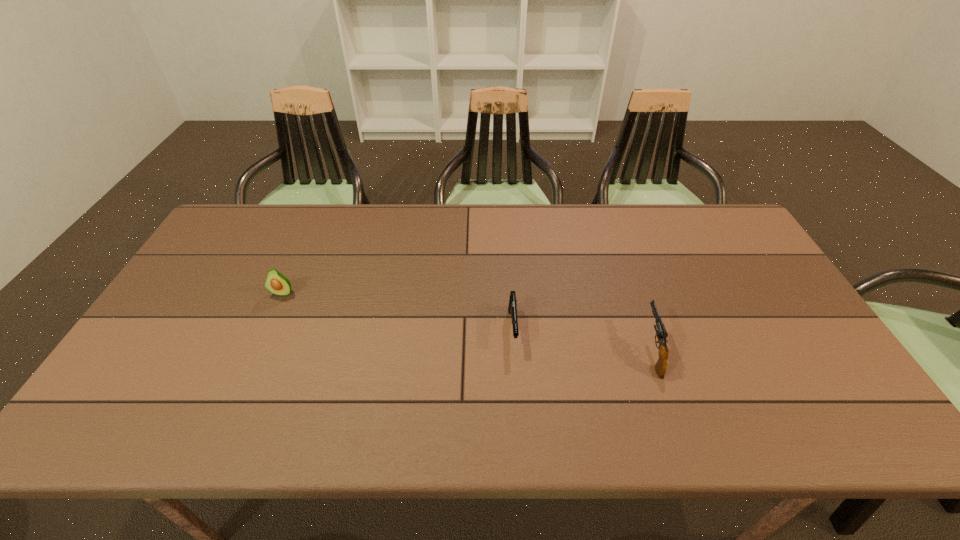
I want to click on the right gun, so click(660, 367).

I want to click on the taller gun, so click(660, 367).

Find the location of a particular element. The height and width of the screenshot is (540, 960). the leftmost object is located at coordinates (277, 283).

This screenshot has height=540, width=960. Identify the location of avocado. (277, 283).

The height and width of the screenshot is (540, 960). What are the coordinates of `the shorter gun` in the screenshot? It's located at (512, 308).

Where is `the left gun`? the left gun is located at coordinates point(512,308).

Locate an element on the screen. blank space located along the barrel of the rightmost object is located at coordinates (617, 251).

Where is `vacant area located 0.280m along the barrel of the rightmost object`? The height and width of the screenshot is (540, 960). vacant area located 0.280m along the barrel of the rightmost object is located at coordinates (619, 257).

Locate an element on the screen. vacant space situated along the barrel of the rightmost object is located at coordinates (613, 239).

This screenshot has width=960, height=540. What are the coordinates of `free point located on the cut side of the avocado` in the screenshot? It's located at (273, 314).